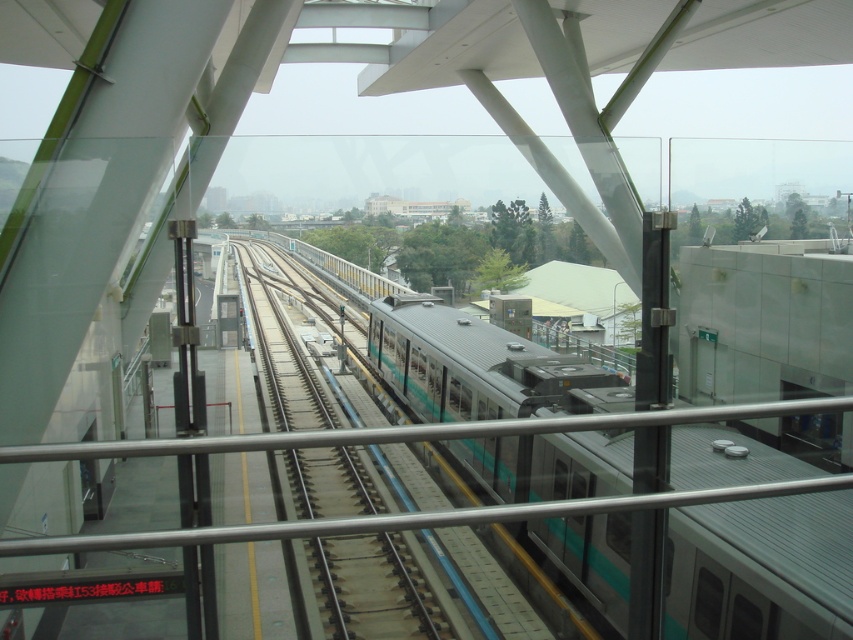
Question: Which point appears closest to the camera in this image?

Choices:
 (A) (408, 604)
 (B) (567, 385)

Answer: (A)

Question: From the image, what is the correct spatial relationship of teal glossy train at center in relation to green metallic train track at center?

Choices:
 (A) above
 (B) below

Answer: (B)

Question: Considering the relative positions of teal glossy train at center and green metallic train track at center in the image provided, where is teal glossy train at center located with respect to green metallic train track at center?

Choices:
 (A) above
 (B) below

Answer: (B)

Question: Can you confirm if teal glossy train at center is positioned above green metallic train track at center?

Choices:
 (A) yes
 (B) no

Answer: (B)

Question: Which point is farther from the camera taking this photo?

Choices:
 (A) (368, 564)
 (B) (767, 588)

Answer: (A)